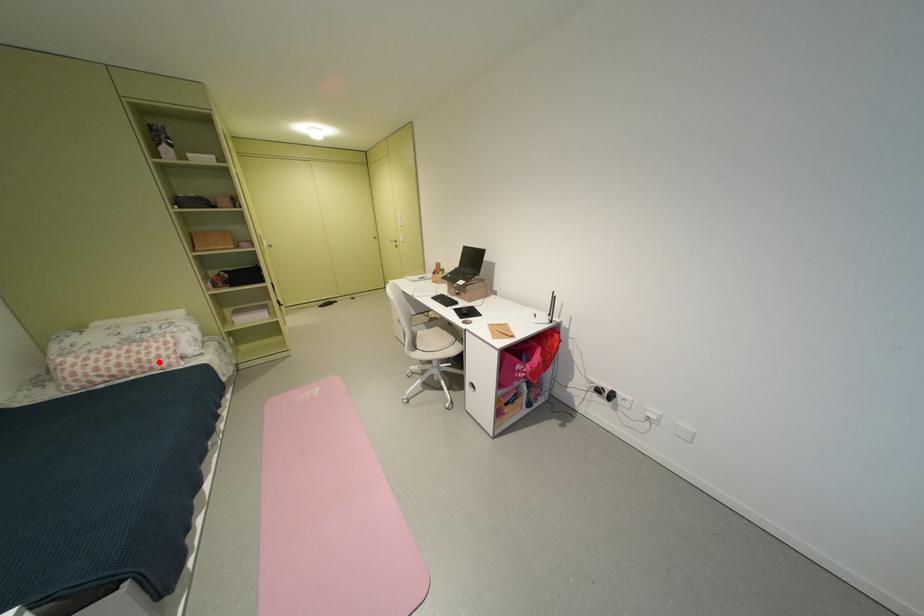
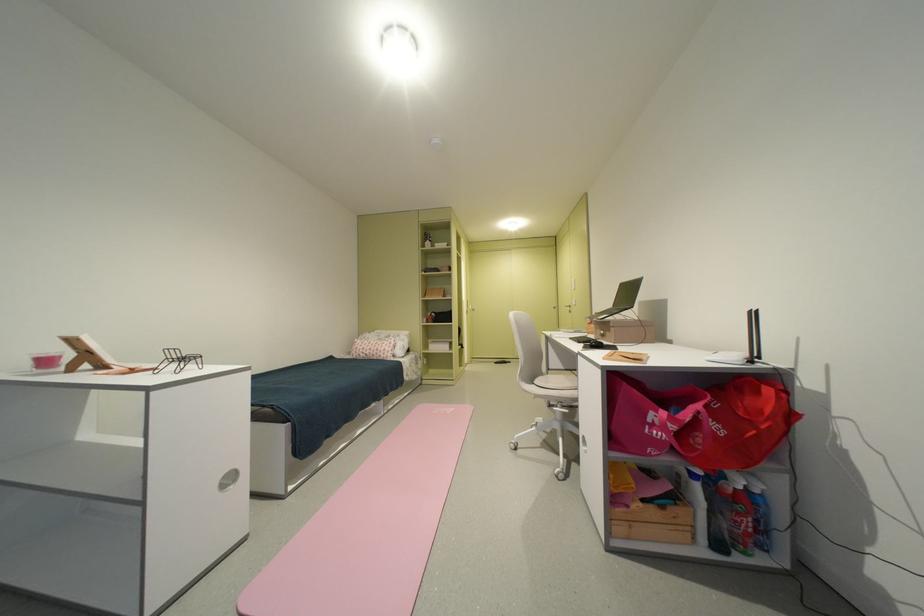
Find the pixel in the second image that matches the highlighted location in the first image.

(390, 352)